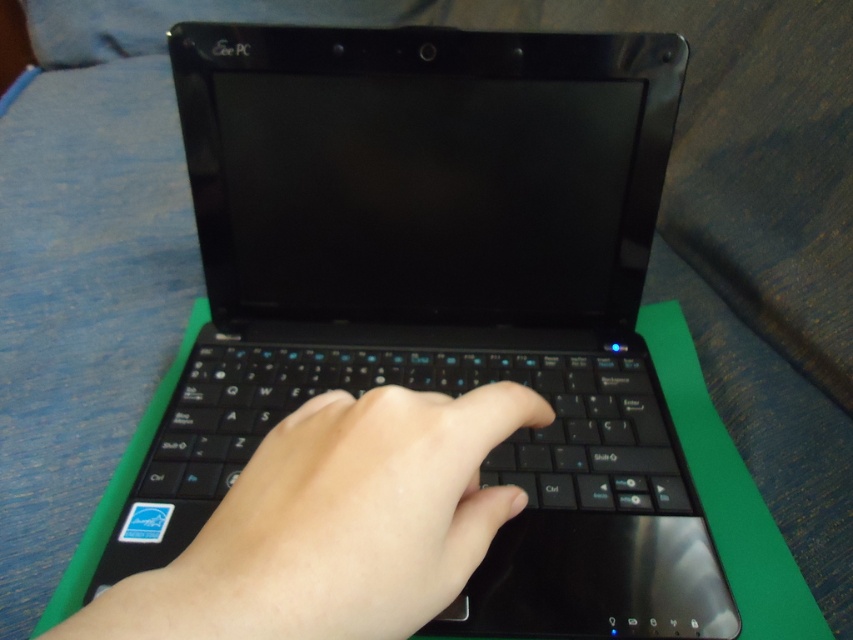
Question: Which point is closer to the camera?

Choices:
 (A) matte black hand at center
 (B) black matte keyboard at center

Answer: (A)

Question: Can you confirm if matte black hand at center is positioned to the left of black matte keyboard at center?

Choices:
 (A) no
 (B) yes

Answer: (B)

Question: Which point appears closest to the camera in this image?

Choices:
 (A) (177, 586)
 (B) (264, 406)

Answer: (A)

Question: Is matte black hand at center closer to the viewer compared to black matte keyboard at center?

Choices:
 (A) no
 (B) yes

Answer: (B)

Question: Does matte black hand at center have a larger size compared to black matte keyboard at center?

Choices:
 (A) yes
 (B) no

Answer: (B)